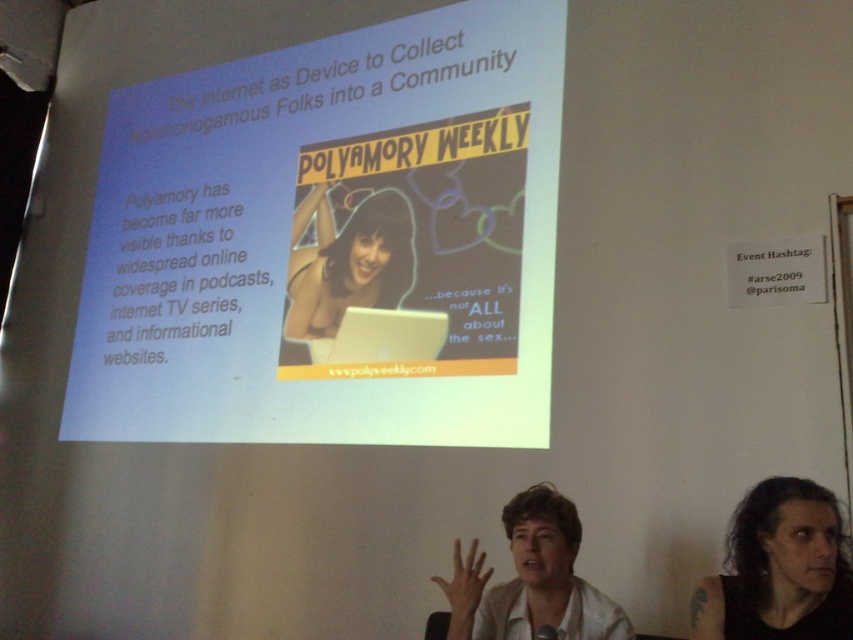
Is point (560, 620) positioned in front of point (315, 195)?

That is True.

Between white matte shirt at center and matte black laptop at center, which one has more height?

matte black laptop at center

Where is `white matte shirt at center`? white matte shirt at center is located at coordinates (531, 579).

Between matte yellow poster at center and matte black laptop at center, which one has less height?

With less height is matte black laptop at center.

Does matte yellow poster at center have a greater height compared to matte black laptop at center?

Indeed, matte yellow poster at center has a greater height compared to matte black laptop at center.

Who is more distant from viewer, (267, 424) or (331, 244)?

The point (331, 244) is more distant.

I want to click on matte yellow poster at center, so click(331, 241).

Can you confirm if dark brown hair at lower right is positioned to the left of white matte shirt at center?

No, dark brown hair at lower right is not to the left of white matte shirt at center.

This screenshot has width=853, height=640. Identify the location of dark brown hair at lower right. point(779,568).